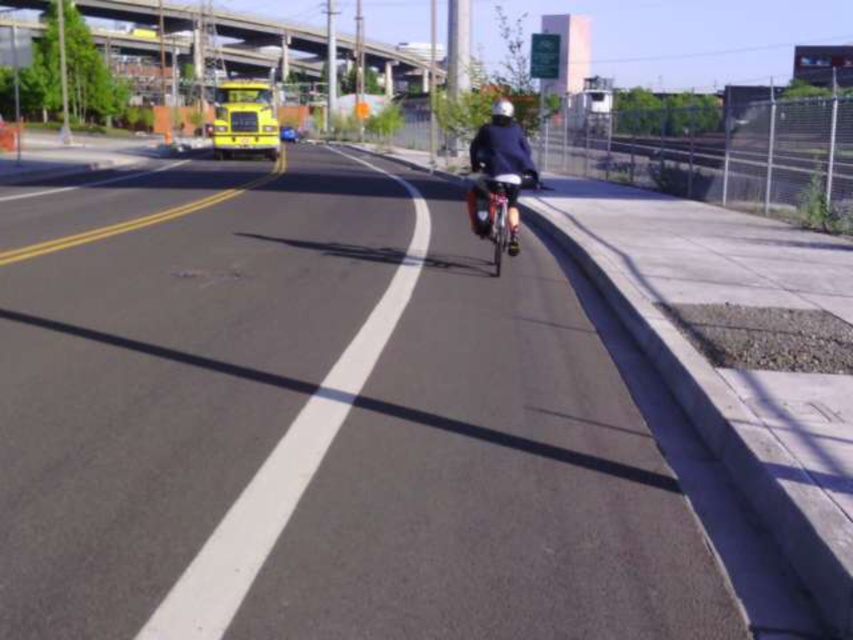
Which is below, concrete bridge at upper center or metallic silver bicycle at center?

metallic silver bicycle at center is lower down.

Who is more forward, [281,22] or [474,205]?

Positioned in front is point [474,205].

Is point (100, 6) positioned in front of point (506, 243)?

That is False.

Locate an element on the screen. concrete bridge at upper center is located at coordinates (212, 24).

The width and height of the screenshot is (853, 640). I want to click on asphalt road at center, so click(320, 422).

Who is lower down, asphalt road at center or metallic silver bicycle at center?

Positioned lower is asphalt road at center.

Which is behind, point (610, 468) or point (515, 237)?

Positioned behind is point (515, 237).

You are a GUI agent. You are given a task and a screenshot of the screen. Output one action in this format:
    pyautogui.click(x=<x>, y=<y>)
    Task: Click on the asphalt road at center
    The width and height of the screenshot is (853, 640).
    Given the screenshot: What is the action you would take?
    pyautogui.click(x=320, y=422)

Is point (129, 10) in front of point (505, 106)?

No, it is behind (505, 106).

Which is below, concrete bridge at upper center or dark blue fabric at center?

dark blue fabric at center

Is point (402, 60) more distant than point (515, 157)?

Yes, point (402, 60) is farther from viewer.

What are the coordinates of `concrete bridge at upper center` in the screenshot? It's located at (212, 24).